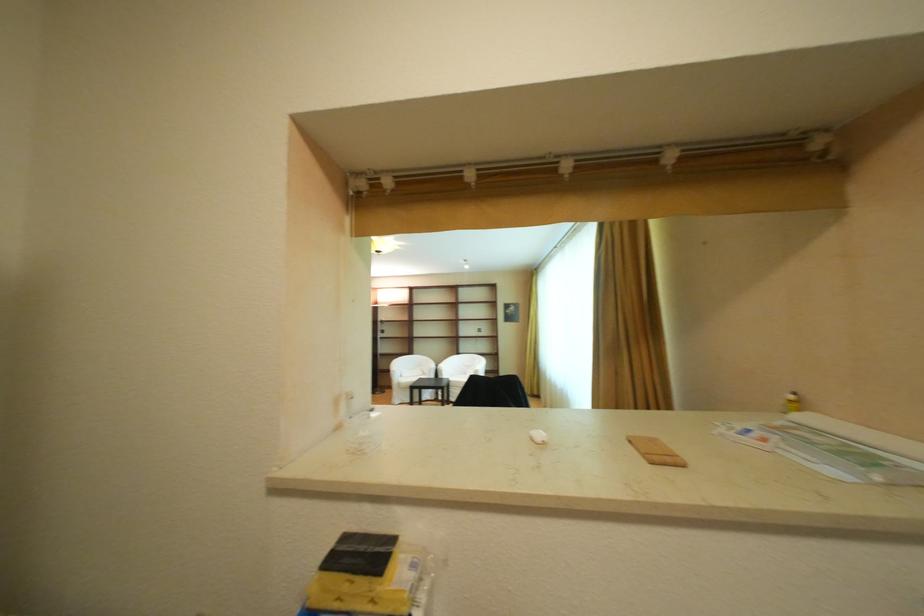
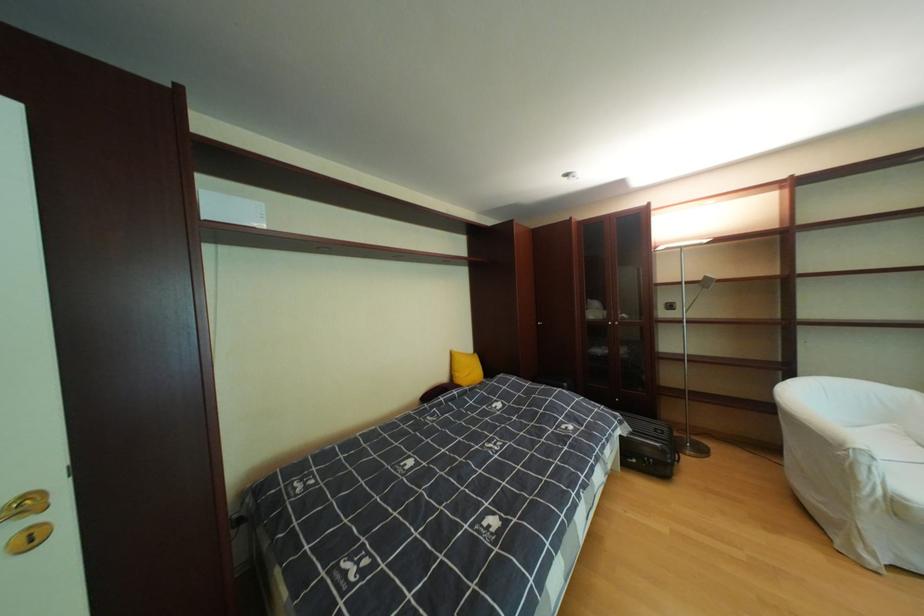
Find the pixel in the second image that matches point (410, 385) in the first image.

(908, 506)